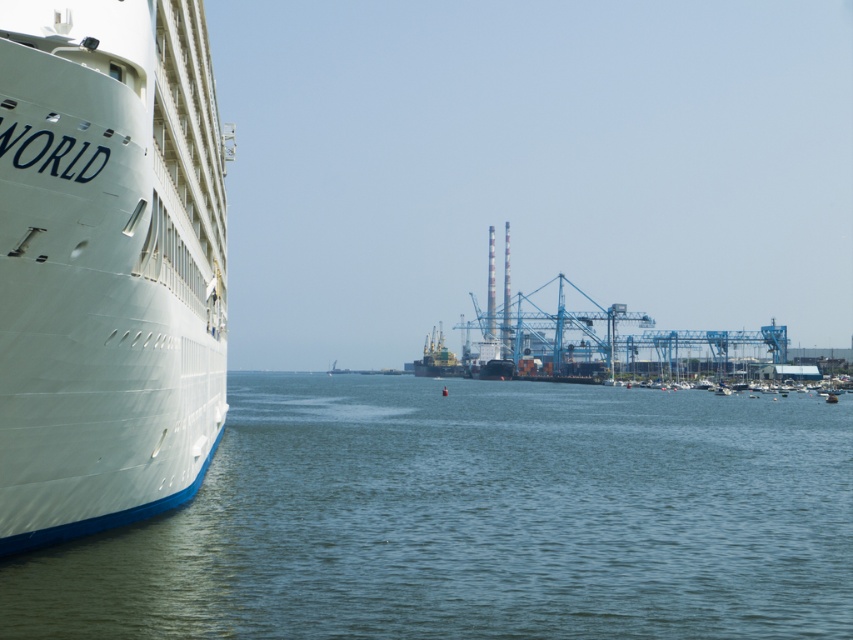
Question: Among these objects, which one is farthest from the camera?

Choices:
 (A) clear blue water at lower left
 (B) white glossy cruise ship at left
 (C) metallic gray ship at center

Answer: (C)

Question: Can you confirm if clear blue water at lower left is bigger than white glossy cruise ship at left?

Choices:
 (A) no
 (B) yes

Answer: (B)

Question: Among these objects, which one is nearest to the camera?

Choices:
 (A) white glossy cruise ship at left
 (B) clear blue water at lower left
 (C) metallic gray ship at center

Answer: (A)

Question: In this image, where is clear blue water at lower left located relative to white glossy cruise ship at left?

Choices:
 (A) left
 (B) right

Answer: (B)

Question: Among these points, which one is farthest from the camera?

Choices:
 (A) (125, 118)
 (B) (434, 328)

Answer: (B)

Question: Does clear blue water at lower left have a smaller size compared to metallic gray ship at center?

Choices:
 (A) no
 (B) yes

Answer: (A)